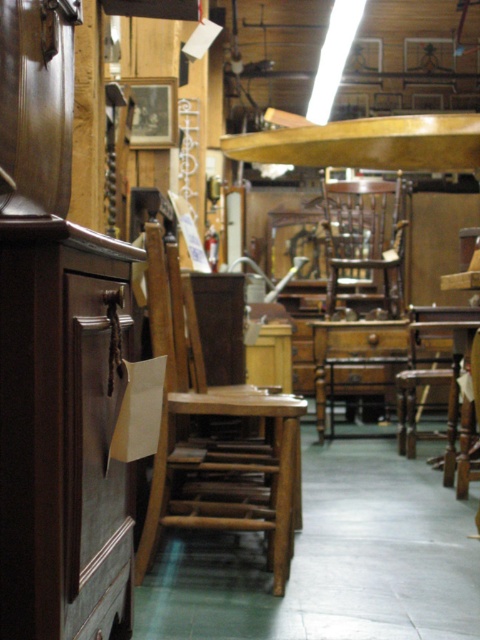
Consider the image. You are a customer in a furniture store and want to walk from the entrance to the wooden table at center. There is a mahogany wood chair at center in your path. Can you walk around the chair to reach the table?

The mahogany wood chair at center is further to the viewer than wooden table at center, so the chair is closer to you. You can walk around the chair to reach the table.

Please provide the coordinates of the mahogany wood chair at center in the image.

The mahogany wood chair at center is located at coordinates point (360,291).